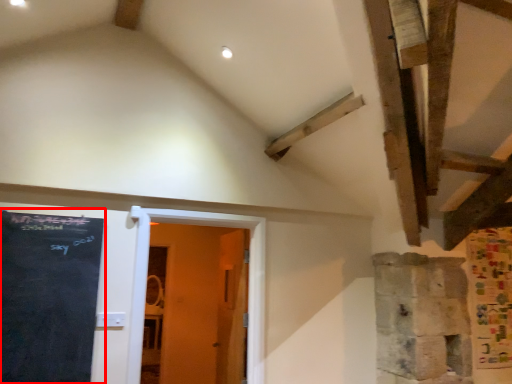
Question: From the image's perspective, where is bulletin board (annotated by the red box) located in relation to door in the image?

Choices:
 (A) below
 (B) above

Answer: (B)